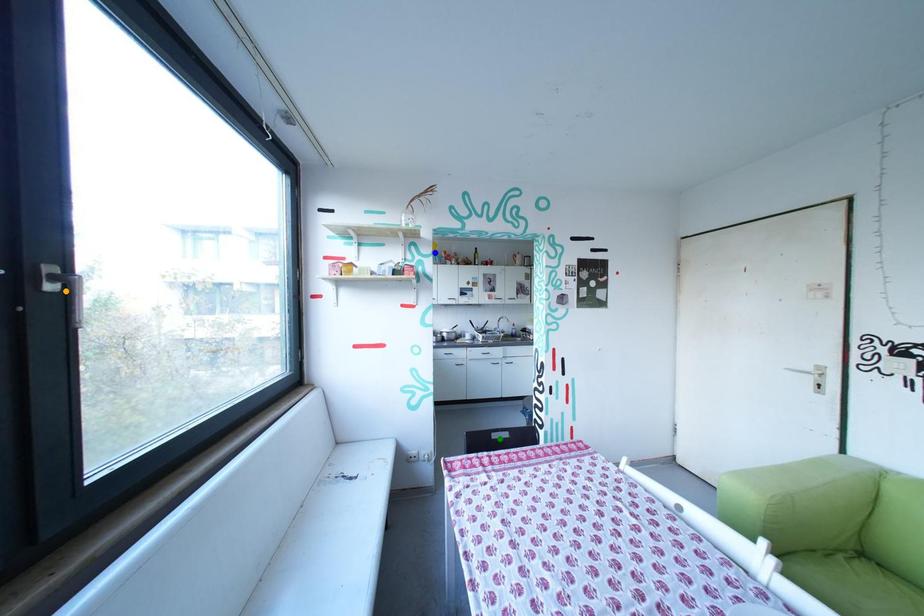
Order these from nearest to farthest:
1. green point
2. orange point
3. blue point

1. blue point
2. green point
3. orange point